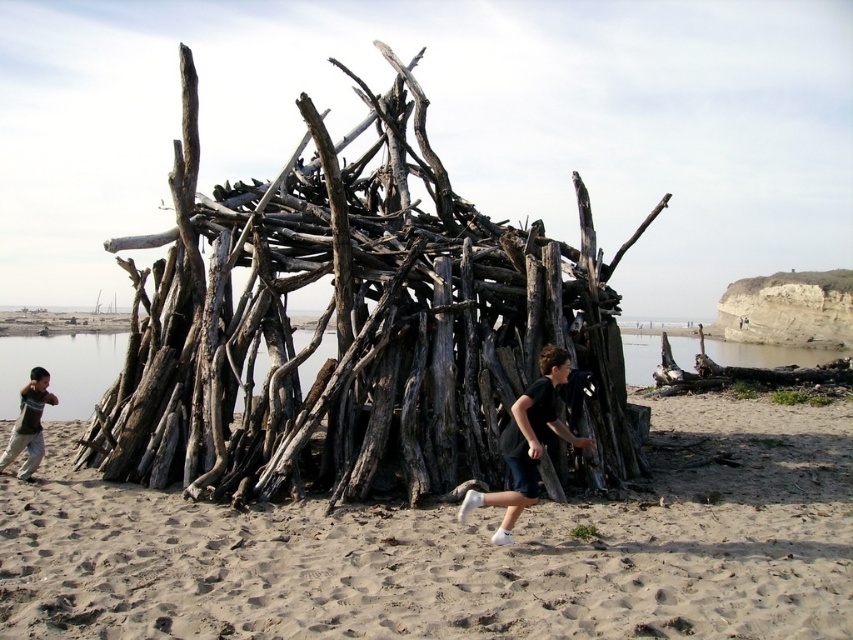
Can you confirm if light beige sand at lower center is taller than black matte shorts at center?

No.

Describe the element at coordinates (459, 552) in the screenshot. Image resolution: width=853 pixels, height=640 pixels. I see `light beige sand at lower center` at that location.

Identify the location of light beige sand at lower center. (459, 552).

Where is `drab wood structure at center`? drab wood structure at center is located at coordinates click(x=358, y=326).

You are a GUI agent. You are given a task and a screenshot of the screen. Output one action in this format:
    pyautogui.click(x=<x>, y=<y>)
    Task: Click on the drab wood structure at center
    
    Given the screenshot: What is the action you would take?
    pyautogui.click(x=358, y=326)

Which is below, black matte shorts at center or dark gray cotton shirt at lower left?

dark gray cotton shirt at lower left is below.

Measure the distance between point (538, 385) and camera.

The distance of point (538, 385) from camera is 25.75 feet.

This screenshot has height=640, width=853. In order to click on black matte shorts at center in this screenshot , I will do pyautogui.click(x=527, y=442).